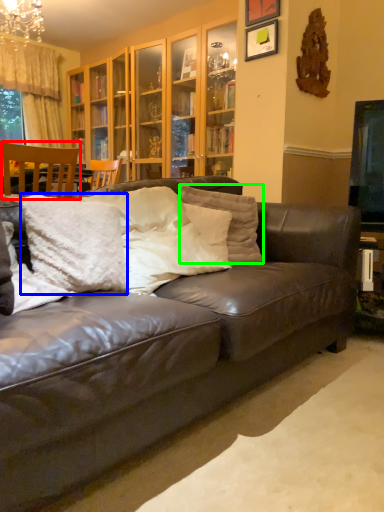
Question: Based on their relative distances, which object is nearer to chair (highlighted by a red box)? Choose from pillow (highlighted by a blue box) and pillow (highlighted by a green box).

Choices:
 (A) pillow
 (B) pillow

Answer: (B)